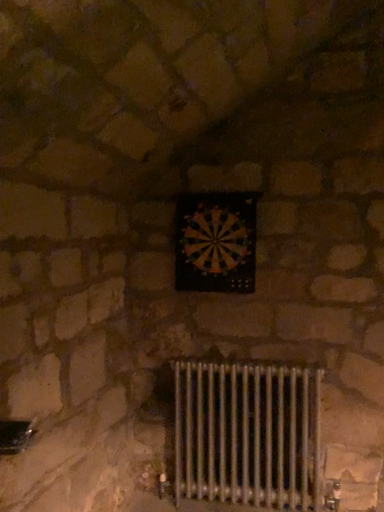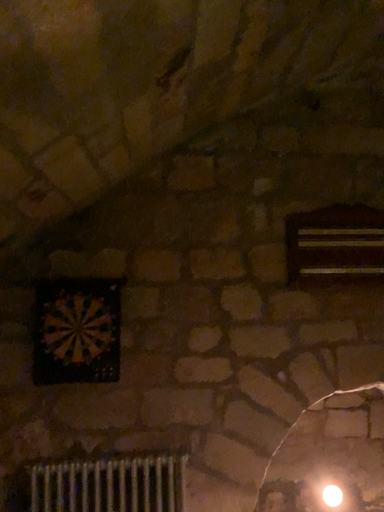
Question: How did the camera likely rotate when shooting the video?

Choices:
 (A) rotated left
 (B) rotated right

Answer: (B)